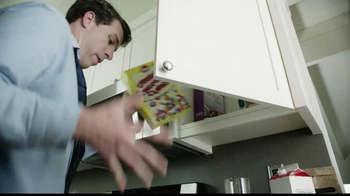
You are a GUI agent. You are given a task and a screenshot of the screen. Output one action in this format:
    pyautogui.click(x=<x>, y=<y>)
    Task: Click on the box of cereal
    Image resolution: width=350 pixels, height=196 pixels.
    Given the screenshot: What is the action you would take?
    pyautogui.click(x=168, y=103)